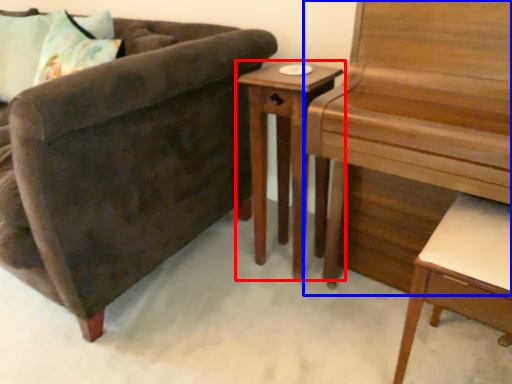
Question: Which object is closer to the camera taking this photo, nightstand (highlighted by a red box) or piano (highlighted by a blue box)?

Choices:
 (A) nightstand
 (B) piano

Answer: (B)